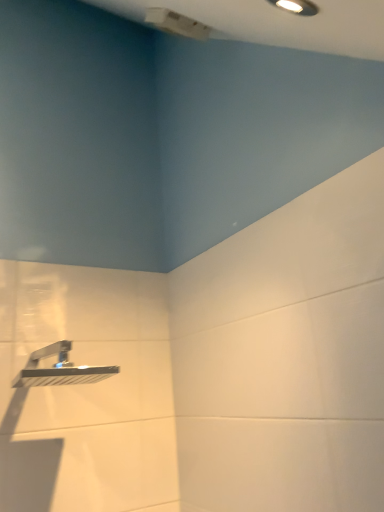
Consider the image. Measure the distance between point (34, 376) and camera.

A distance of 91.10 centimeters exists between point (34, 376) and camera.

Where is `silver metallic tap at lower left`? silver metallic tap at lower left is located at coordinates pyautogui.click(x=59, y=369).

Describe the element at coordinates (59, 369) in the screenshot. I see `silver metallic tap at lower left` at that location.

At what (x,y) coordinates should I click in order to perform the action: click on silver metallic tap at lower left. Please return your answer as a coordinate pair (x, y). Image resolution: width=384 pixels, height=512 pixels. Looking at the image, I should click on (59, 369).